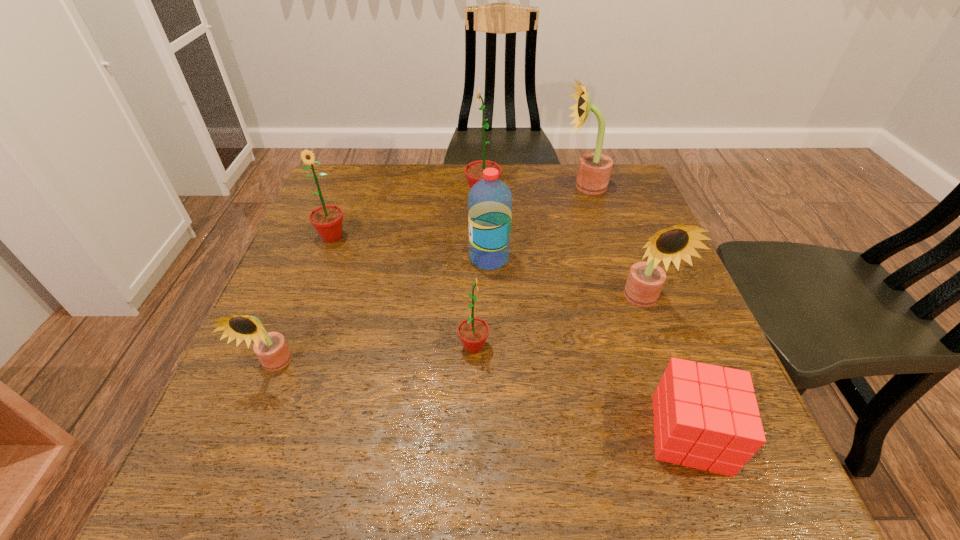
What are the coordinates of `free space located 0.340m on the front label of the red water bottle` in the screenshot? It's located at (324, 259).

You are a GUI agent. You are given a task and a screenshot of the screen. Output one action in this format:
    pyautogui.click(x=<x>, y=<y>)
    Task: Click on the vacant area located on the front label of the red water bottle
    The width and height of the screenshot is (960, 540).
    Given the screenshot: What is the action you would take?
    pyautogui.click(x=319, y=259)

The image size is (960, 540). I want to click on vacant space located 0.310m on the front label of the red water bottle, so click(336, 259).

At what (x,y) coordinates should I click in order to perform the action: click on vacant space situated 0.070m on the face of the smallest green sunflower. Please return your answer as a coordinate pair (x, y). This screenshot has height=540, width=960. Looking at the image, I should click on (525, 346).

The height and width of the screenshot is (540, 960). Identify the location of vacant region located on the face of the nearest yellow sunflower. (239, 454).

At what (x,y) coordinates should I click in order to perform the action: click on vacant space situated 0.360m on the back of the nearest object. Please return your answer as a coordinate pair (x, y). Looking at the image, I should click on (627, 259).

Image resolution: width=960 pixels, height=540 pixels. What are the coordinates of `object situated at the near edge` in the screenshot? It's located at (705, 417).

The width and height of the screenshot is (960, 540). Identify the location of cube located in the right edge section of the desktop. (705, 417).

This screenshot has height=540, width=960. Identify the location of object that is at the far right corner. pyautogui.click(x=594, y=170).

Where is `object that is at the near right corner`? object that is at the near right corner is located at coordinates (705, 417).